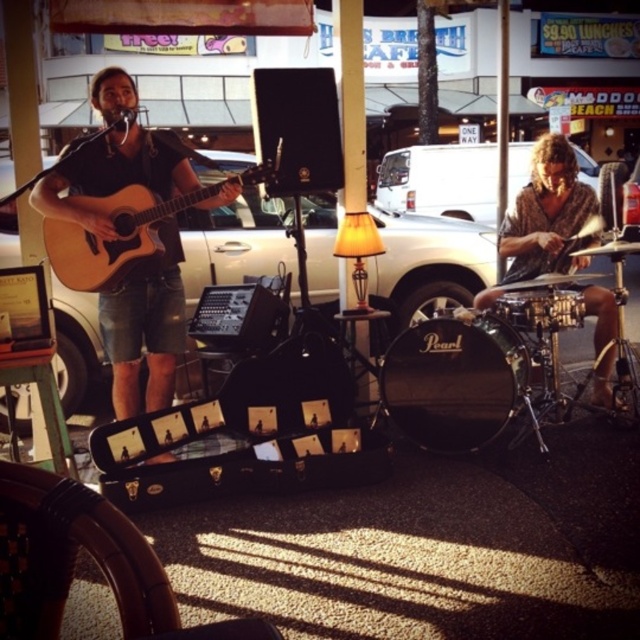
Question: Which point is farther from the camera taking this photo?

Choices:
 (A) (516, 328)
 (B) (509, 387)
 (C) (499, 294)

Answer: (C)

Question: Is matte brown guitar at left to the right of natural wood acoustic guitar at left from the viewer's perspective?

Choices:
 (A) no
 (B) yes

Answer: (A)

Question: Is black pearl drum at center bigger than textured brown shirt at right?

Choices:
 (A) yes
 (B) no

Answer: (B)

Question: Which of the following is the closest to the observer?

Choices:
 (A) (58, 257)
 (B) (144, 163)

Answer: (A)

Question: Does textured brown shirt at right appear under gold metallic drum at right?

Choices:
 (A) no
 (B) yes

Answer: (A)

Question: Among these objects, which one is farthest from the camera?

Choices:
 (A) gold metallic drum at right
 (B) black pearl drum at center
 (C) textured brown shirt at right
 (D) matte brown guitar at left

Answer: (C)